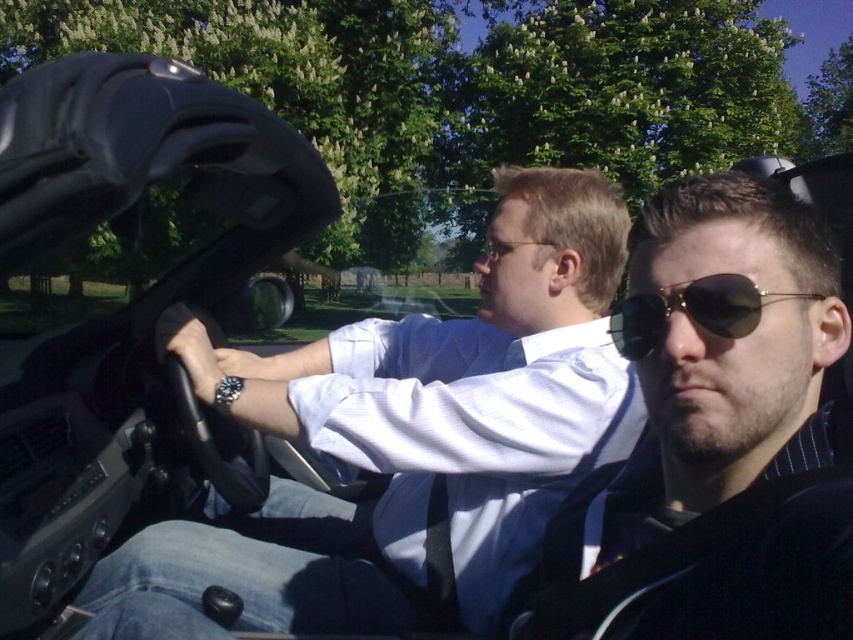
Question: Can you confirm if matte black sunglasses at center is positioned below gold reflective sunglasses at center?

Choices:
 (A) yes
 (B) no

Answer: (A)

Question: Which of the following is the closest to the observer?

Choices:
 (A) matte black sunglasses at center
 (B) gold reflective sunglasses at center

Answer: (A)

Question: Which object appears closest to the camera in this image?

Choices:
 (A) white shirt at center
 (B) gold reflective sunglasses at center

Answer: (B)

Question: Does white shirt at center appear over matte black sunglasses at center?

Choices:
 (A) no
 (B) yes

Answer: (B)

Question: Estimate the real-world distances between objects in this image. Which object is closer to the gold reflective sunglasses at center?

Choices:
 (A) white shirt at center
 (B) matte black sunglasses at center

Answer: (B)

Question: Is white shirt at center bigger than matte black sunglasses at center?

Choices:
 (A) no
 (B) yes

Answer: (B)